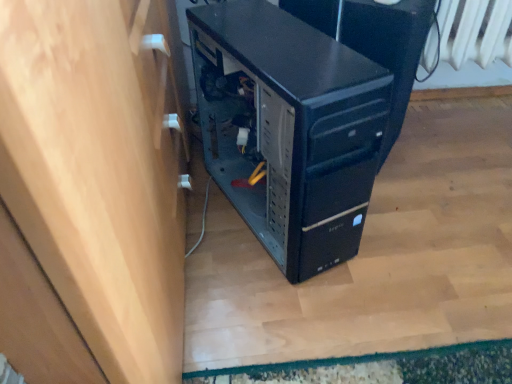
The height and width of the screenshot is (384, 512). Describe the element at coordinates (289, 129) in the screenshot. I see `black plastic computer tower at center` at that location.

This screenshot has height=384, width=512. What are the coordinates of `black plastic computer tower at center` in the screenshot? It's located at (289, 129).

Where is `black plastic computer tower at center`? The height and width of the screenshot is (384, 512). black plastic computer tower at center is located at coordinates (289, 129).